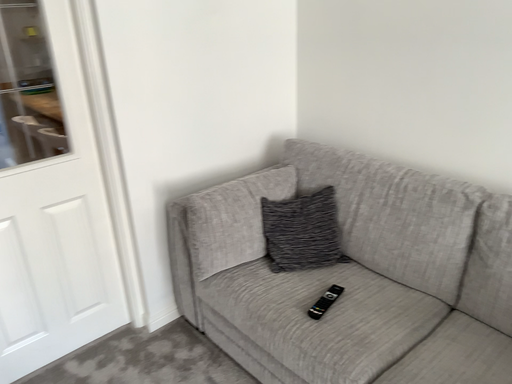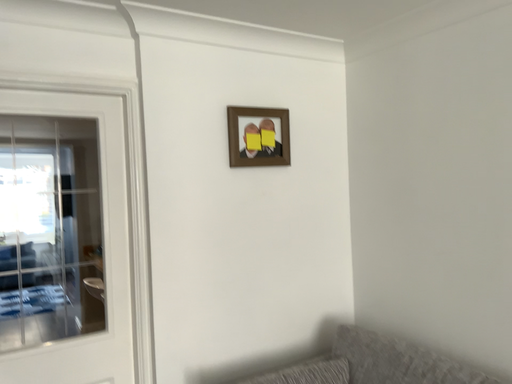
Question: Which way did the camera rotate in the video?

Choices:
 (A) rotated upward
 (B) rotated downward

Answer: (A)